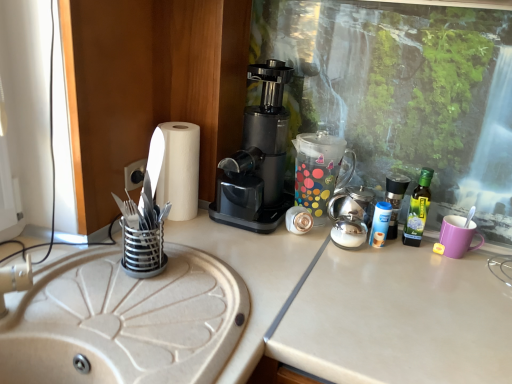
What do you see at coordinates (134, 174) in the screenshot? This screenshot has width=512, height=384. I see `black plastic socket at center-left` at bounding box center [134, 174].

Locate an element on the screen. The image size is (512, 384). transparent polka dot coffee pot at center is located at coordinates (319, 169).

Where is `satin silver teapot at center-right`? This screenshot has width=512, height=384. satin silver teapot at center-right is located at coordinates (352, 203).

Locate an element on the screen. The image size is (512, 384). black plastic coffee maker at center is located at coordinates (257, 159).

Between point (473, 248) and point (396, 196), which one is positioned in front?

Positioned in front is point (473, 248).

Is purple matte mug at right not close to blue plastic bottle at right, which appears as the second bottle when viewed from the right?

No, purple matte mug at right is not far from blue plastic bottle at right, which appears as the second bottle when viewed from the right.

Is purple matte mug at right smaller than blue plastic bottle at right, which is the first bottle in left-to-right order?

Yes, purple matte mug at right is smaller than blue plastic bottle at right, which is the first bottle in left-to-right order.

Is black plastic coffee maker at center inside blue plastic bottle at right, which appears as the second bottle when viewed from the right?

Actually, black plastic coffee maker at center is outside blue plastic bottle at right, which appears as the second bottle when viewed from the right.

Considering the sizes of objects blue plastic bottle at right, which appears as the second bottle when viewed from the right, and black plastic coffee maker at center in the image provided, who is taller, blue plastic bottle at right, which appears as the second bottle when viewed from the right, or black plastic coffee maker at center?

black plastic coffee maker at center is taller.

Is blue plastic bottle at right, which is the first bottle in left-to-right order, at the back of transparent polka dot coffee pot at center?

transparent polka dot coffee pot at center is not turned away from blue plastic bottle at right, which is the first bottle in left-to-right order.

From the image's perspective, which is above, transparent polka dot coffee pot at center or blue plastic bottle at right, which appears as the second bottle when viewed from the right?

transparent polka dot coffee pot at center.

How different are the orientations of transparent polka dot coffee pot at center and blue plastic bottle at right, which appears as the second bottle when viewed from the right, in degrees?

The angle between the facing direction of transparent polka dot coffee pot at center and the facing direction of blue plastic bottle at right, which appears as the second bottle when viewed from the right, is 2.29e-05 degrees.

Can you confirm if transparent polka dot coffee pot at center is positioned to the right of blue plastic bottle at right, which appears as the second bottle when viewed from the right?

In fact, transparent polka dot coffee pot at center is to the left of blue plastic bottle at right, which appears as the second bottle when viewed from the right.

The image size is (512, 384). I want to click on electric outlet behind the white paper towel at left, so click(x=134, y=174).

Who is taller, black plastic socket at center-left or white paper towel at left?

white paper towel at left.

What's the angular difference between black plastic socket at center-left and white paper towel at left's facing directions?

They differ by 94.4 degrees in their facing directions.

Is black plastic socket at center-left located outside white paper towel at left?

black plastic socket at center-left lies outside white paper towel at left's area.

From a real-world perspective, which object rests below the other?

In real-world perspective, beige matte sink at left is lower.

Considering the relative sizes of green glass bottle at right, the 1th bottle viewed from the right, and beige matte sink at left in the image provided, is green glass bottle at right, the 1th bottle viewed from the right, wider than beige matte sink at left?

No, green glass bottle at right, the 1th bottle viewed from the right, is not wider than beige matte sink at left.

What are the coordinates of `sink that appears below the green glass bottle at right, acting as the 2th bottle starting from the left (from a real-world perspective)` in the screenshot? It's located at (124, 320).

Between point (422, 226) and point (143, 314), which one is positioned behind?

The point (422, 226) is farther from the camera.

Is purple matte mug at right thinner than black plastic socket at center-left?

No.

Can we say purple matte mug at right lies outside black plastic socket at center-left?

Indeed, purple matte mug at right is completely outside black plastic socket at center-left.

Can you confirm if purple matte mug at right is taller than black plastic socket at center-left?

Correct, purple matte mug at right is much taller as black plastic socket at center-left.

From the image's perspective, is purple matte mug at right located above or below black plastic socket at center-left?

Clearly, from the image's perspective, purple matte mug at right is below black plastic socket at center-left.

Between black plastic socket at center-left and satin silver teapot at center-right, which one is positioned in front?

satin silver teapot at center-right is closer to the camera.

From a real-world perspective, between black plastic socket at center-left and satin silver teapot at center-right, who is vertically lower?

satin silver teapot at center-right is physically lower.

Is black plastic socket at center-left next to satin silver teapot at center-right and touching it?

No.

Choose the correct answer: Is black plastic socket at center-left inside satin silver teapot at center-right or outside it?

black plastic socket at center-left is spatially situated outside satin silver teapot at center-right.

From the purple matte mug at right, count the 2nd bottle to the left and point to it. Please provide its 2D coordinates.

[(395, 199)]

At what (x,y) coordinates should I click in order to perform the action: click on coffee maker lying above the blue plastic bottle at right, which is the first bottle in left-to-right order (from the image's perspective). Please return your answer as a coordinate pair (x, y). Image resolution: width=512 pixels, height=384 pixels. Looking at the image, I should click on (257, 159).

Which object lies further to the anchor point white paper towel at left, green glass bottle at right, acting as the 2th bottle starting from the left, or purple matte mug at right?

purple matte mug at right.

Estimate the real-world distances between objects in this image. Which object is further from blue plastic bottle at right, which is the first bottle in left-to-right order, purple matte mug at right or satin silver teapot at center-right?

Based on the image, purple matte mug at right appears to be further to blue plastic bottle at right, which is the first bottle in left-to-right order.

Based on the photo, considering their positions, is purple matte mug at right positioned closer to transparent polka dot coffee pot at center than black plastic coffee maker at center?

Based on the image, black plastic coffee maker at center appears to be nearer to transparent polka dot coffee pot at center.

Estimate the real-world distances between objects in this image. Which object is further from green glass bottle at right, acting as the 2th bottle starting from the left, white paper towel at left or transparent polka dot coffee pot at center?

Among the two, white paper towel at left is located further to green glass bottle at right, acting as the 2th bottle starting from the left.

Based on their spatial positions, is white paper towel at left or black plastic socket at center-left further from blue plastic bottle at right, which is the first bottle in left-to-right order?

black plastic socket at center-left lies further to blue plastic bottle at right, which is the first bottle in left-to-right order, than the other object.

Which object lies further to the anchor point black plastic coffee maker at center, beige matte sink at left or black plastic socket at center-left?

Among the two, beige matte sink at left is located further to black plastic coffee maker at center.

From the image, which object appears to be farther from transparent polka dot coffee pot at center, black plastic socket at center-left or satin silver teapot at center-right?

Among the two, black plastic socket at center-left is located further to transparent polka dot coffee pot at center.

Estimate the real-world distances between objects in this image. Which object is closer to white paper towel at left, blue plastic bottle at right, which appears as the second bottle when viewed from the right, or beige matte sink at left?

beige matte sink at left.

The height and width of the screenshot is (384, 512). I want to click on coffee maker between beige matte sink at left and black plastic socket at center-left along the z-axis, so click(257, 159).

You are a GUI agent. You are given a task and a screenshot of the screen. Output one action in this format:
    pyautogui.click(x=<x>, y=<y>)
    Task: Click on the coffee maker between beige matte sink at left and white paper towel at left along the z-axis
    
    Given the screenshot: What is the action you would take?
    pyautogui.click(x=257, y=159)

Where is `appliance located between transparent polka dot coffee pot at center and blue plastic bottle at right, which is the first bottle in left-to-right order, in the left-right direction`? The height and width of the screenshot is (384, 512). appliance located between transparent polka dot coffee pot at center and blue plastic bottle at right, which is the first bottle in left-to-right order, in the left-right direction is located at coordinates (352, 203).

You are a GUI agent. You are given a task and a screenshot of the screen. Output one action in this format:
    pyautogui.click(x=<x>, y=<y>)
    Task: Click on the bottle between white paper towel at left and green glass bottle at right, the 1th bottle viewed from the right, from left to right
    The image size is (512, 384).
    Given the screenshot: What is the action you would take?
    pyautogui.click(x=395, y=199)